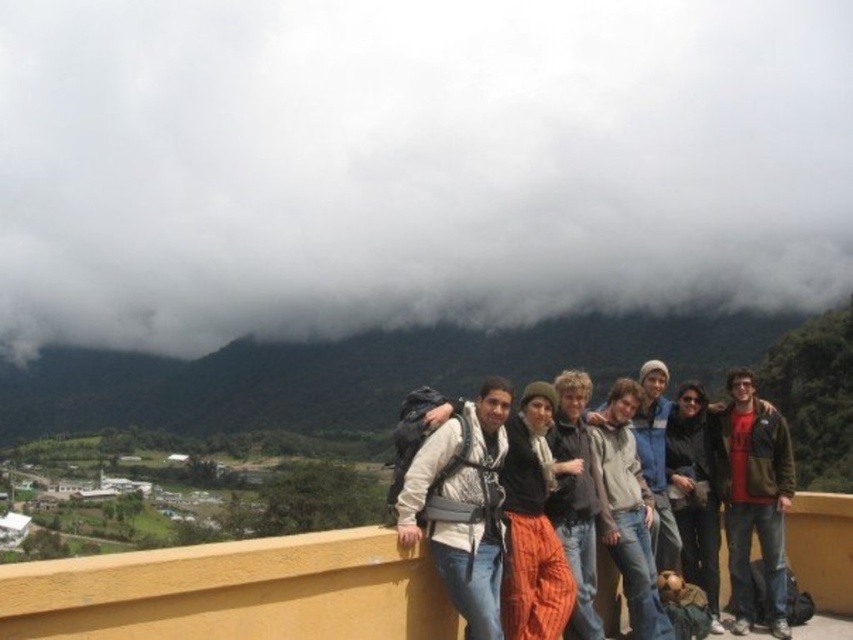
Question: Is red jacket at right thinner than dark gray sweater at center?

Choices:
 (A) no
 (B) yes

Answer: (A)

Question: Is red jacket at right closer to camera compared to light brown leather jacket at center?

Choices:
 (A) no
 (B) yes

Answer: (A)

Question: Does yellow concrete ledge at center come behind red jacket at right?

Choices:
 (A) no
 (B) yes

Answer: (A)

Question: Which of these objects is positioned farthest from the matte white jacket at center?

Choices:
 (A) light brown leather jacket at center
 (B) knit orange pants at center
 (C) red jacket at right
 (D) dark gray sweater at center

Answer: (C)

Question: Considering the real-world distances, which object is farthest from the dark gray sweater at center?

Choices:
 (A) knit orange pants at center
 (B) light brown leather jacket at center

Answer: (A)

Question: Which point is closer to the camera taking this photo?

Choices:
 (A) (621, 552)
 (B) (692, 401)

Answer: (A)